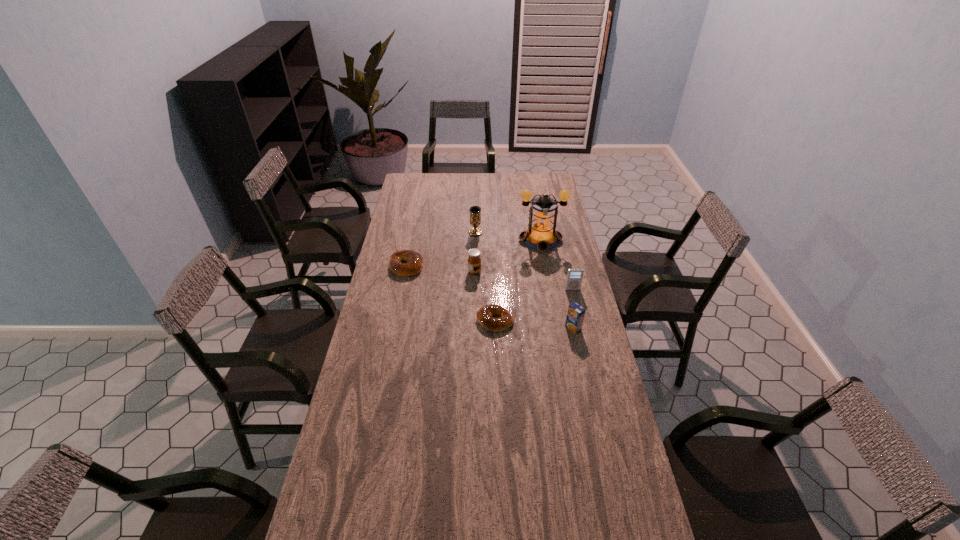
Find the location of a particular element. This screenshot has height=540, width=960. vacant space at the far edge is located at coordinates (502, 186).

Where is `free region at the left edge of the desktop`? The height and width of the screenshot is (540, 960). free region at the left edge of the desktop is located at coordinates (365, 349).

In order to click on vacant region at the right edge of the desktop in this screenshot , I will do `click(564, 247)`.

I want to click on free space at the far left corner of the desktop, so click(x=431, y=180).

Identify the location of free space at the far right corner of the desktop. The width and height of the screenshot is (960, 540). [x=556, y=181].

Where is `vacant area that lies between the shortest object and the honey`? The width and height of the screenshot is (960, 540). vacant area that lies between the shortest object and the honey is located at coordinates (485, 296).

The height and width of the screenshot is (540, 960). I want to click on empty space that is in between the tallest object and the iPod, so click(557, 265).

Locate an element on the screen. This screenshot has height=540, width=960. blank region between the shorter bagel and the third nearest object is located at coordinates (534, 305).

Locate an element on the screen. This screenshot has height=540, width=960. free space between the orange_juice and the chalice is located at coordinates (524, 280).

The height and width of the screenshot is (540, 960). Find the location of `free space between the second tallest object and the nearer bagel`. free space between the second tallest object and the nearer bagel is located at coordinates (485, 276).